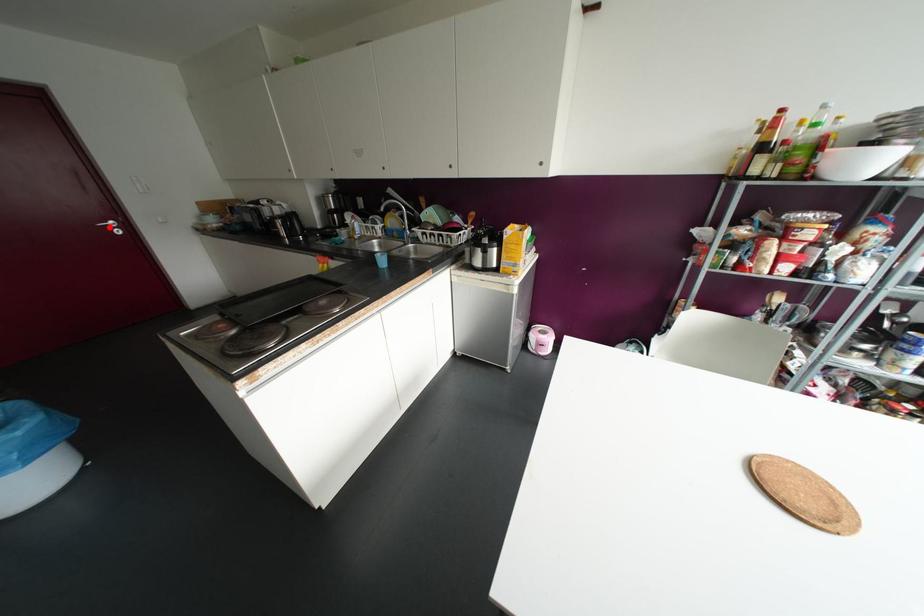
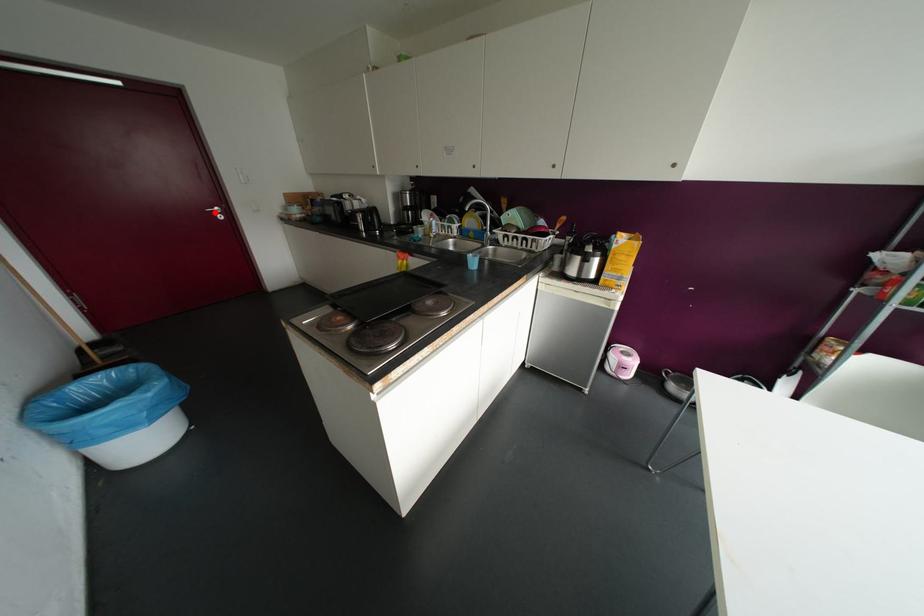
I am providing you with two images of the same scene from different viewpoints. A red point is marked on the first image and another point is marked on the second image. Are the points marked in image1 and image2 representing the same 3D position?

Yes